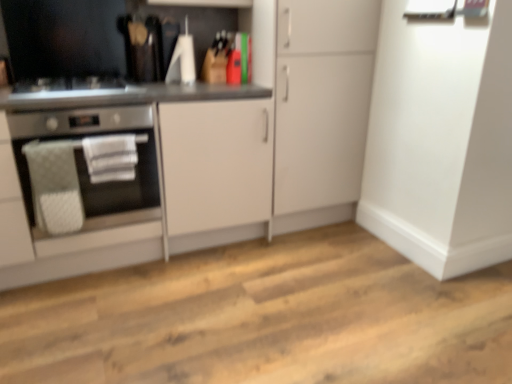
The width and height of the screenshot is (512, 384). What do you see at coordinates (322, 100) in the screenshot? I see `white matte cabinet at center, which appears as the second cabinetry when viewed from the left` at bounding box center [322, 100].

The image size is (512, 384). Find the location of `stainless steel oven at left`. stainless steel oven at left is located at coordinates (86, 165).

The height and width of the screenshot is (384, 512). What do you see at coordinates (73, 88) in the screenshot?
I see `satin black gas stove at left` at bounding box center [73, 88].

Describe the element at coordinates (213, 145) in the screenshot. The height and width of the screenshot is (384, 512). I see `matte white cabinet at center, which ranks as the second cabinetry in right-to-left order` at that location.

Where is `white matte cabinet at center, the 1th cabinetry viewed from the right`? This screenshot has height=384, width=512. white matte cabinet at center, the 1th cabinetry viewed from the right is located at coordinates (322, 100).

Is white matte cabinet at center, which appears as the second cabinetry when viewed from the left, oriented away from matte white cabinet at center, the first cabinetry positioned from the left?

No, matte white cabinet at center, the first cabinetry positioned from the left, is not at the back of white matte cabinet at center, which appears as the second cabinetry when viewed from the left.

Which object is further away from the camera, white matte cabinet at center, which appears as the second cabinetry when viewed from the left, or matte white cabinet at center, which ranks as the second cabinetry in right-to-left order?

white matte cabinet at center, which appears as the second cabinetry when viewed from the left, is more distant.

In terms of size, does white matte cabinet at center, which appears as the second cabinetry when viewed from the left, appear bigger or smaller than matte white cabinet at center, which ranks as the second cabinetry in right-to-left order?

Clearly, white matte cabinet at center, which appears as the second cabinetry when viewed from the left, is smaller in size than matte white cabinet at center, which ranks as the second cabinetry in right-to-left order.

You are a GUI agent. You are given a task and a screenshot of the screen. Output one action in this format:
    pyautogui.click(x=<x>, y=<y>)
    Task: Click on the home appliance that is under the white matte cabinet at center, which appears as the second cabinetry when viewed from the left (from a real-world perspective)
    
    Given the screenshot: What is the action you would take?
    pyautogui.click(x=86, y=165)

Who is shorter, white matte cabinet at center, which appears as the second cabinetry when viewed from the left, or stainless steel oven at left?

stainless steel oven at left.

Is white matte cabinet at center, which appears as the second cabinetry when viewed from the left, looking in the opposite direction of stainless steel oven at left?

No, white matte cabinet at center, which appears as the second cabinetry when viewed from the left, is not facing the opposite direction of stainless steel oven at left.

From a real-world perspective, is white matte cabinet at center, the 1th cabinetry viewed from the right, above or below stainless steel oven at left?

Clearly, from a real-world perspective, white matte cabinet at center, the 1th cabinetry viewed from the right, is above stainless steel oven at left.

Which is nearer, (x=324, y=35) or (x=150, y=211)?

Positioned in front is point (x=150, y=211).

Choose the correct answer: Is matte white cabinet at center, the first cabinetry positioned from the left, inside stainless steel oven at left or outside it?

matte white cabinet at center, the first cabinetry positioned from the left, is located beyond the bounds of stainless steel oven at left.

Does matte white cabinet at center, the first cabinetry positioned from the left, have a smaller size compared to stainless steel oven at left?

No, matte white cabinet at center, the first cabinetry positioned from the left, is not smaller than stainless steel oven at left.

Is matte white cabinet at center, the first cabinetry positioned from the left, facing towards stainless steel oven at left?

Yes, matte white cabinet at center, the first cabinetry positioned from the left, faces towards stainless steel oven at left.

From the picture: Relative to satin black gas stove at left, is matte white cabinet at center, the first cabinetry positioned from the left, in front or behind?

matte white cabinet at center, the first cabinetry positioned from the left, is positioned closer to the viewer than satin black gas stove at left.

Would you say matte white cabinet at center, which ranks as the second cabinetry in right-to-left order, is outside satin black gas stove at left?

Absolutely, matte white cabinet at center, which ranks as the second cabinetry in right-to-left order, is external to satin black gas stove at left.

You are a GUI agent. You are given a task and a screenshot of the screen. Output one action in this format:
    pyautogui.click(x=<x>, y=<y>)
    Task: Click on the 1st cabinetry to the right of the satin black gas stove at left, starting your count from the anchor
    
    Given the screenshot: What is the action you would take?
    pyautogui.click(x=213, y=145)

Is point (3, 284) in front of point (30, 89)?

No, it is behind (30, 89).

From the image's perspective, which is below, satin black gas stove at left or stainless steel oven at left?

stainless steel oven at left is shown below in the image.

Is satin black gas stove at left taller than stainless steel oven at left?

No, satin black gas stove at left is not taller than stainless steel oven at left.

From the picture: How distant is satin black gas stove at left from stainless steel oven at left?

satin black gas stove at left is 10.49 inches from stainless steel oven at left.

Identify the location of home appliance that is below the satin black gas stove at left (from the image's perspective). This screenshot has height=384, width=512. (86, 165).

Is matte white cabinet at center, the first cabinetry positioned from the left, smaller than white matte cabinet at center, the 1th cabinetry viewed from the right?

Actually, matte white cabinet at center, the first cabinetry positioned from the left, might be larger than white matte cabinet at center, the 1th cabinetry viewed from the right.

How far apart are matte white cabinet at center, which ranks as the second cabinetry in right-to-left order, and white matte cabinet at center, the 1th cabinetry viewed from the right?

A distance of 7.87 inches exists between matte white cabinet at center, which ranks as the second cabinetry in right-to-left order, and white matte cabinet at center, the 1th cabinetry viewed from the right.

Is matte white cabinet at center, which ranks as the second cabinetry in right-to-left order, turned away from white matte cabinet at center, which appears as the second cabinetry when viewed from the left?

No, matte white cabinet at center, which ranks as the second cabinetry in right-to-left order, is not facing the opposite direction of white matte cabinet at center, which appears as the second cabinetry when viewed from the left.

Is matte white cabinet at center, the first cabinetry positioned from the left, closer to the viewer compared to white matte cabinet at center, which appears as the second cabinetry when viewed from the left?

Yes.

Where is `the 1st cabinetry below the satin black gas stove at left (from the image's perspective)`? the 1st cabinetry below the satin black gas stove at left (from the image's perspective) is located at coordinates (322, 100).

Between satin black gas stove at left and white matte cabinet at center, which appears as the second cabinetry when viewed from the left, which one appears on the left side from the viewer's perspective?

satin black gas stove at left.

From the image's perspective, is satin black gas stove at left located above white matte cabinet at center, the 1th cabinetry viewed from the right?

Yes, from the image's perspective, satin black gas stove at left is above white matte cabinet at center, the 1th cabinetry viewed from the right.

Image resolution: width=512 pixels, height=384 pixels. What are the coordinates of `cabinetry above the matte white cabinet at center, which ranks as the second cabinetry in right-to-left order (from a real-world perspective)` in the screenshot? It's located at (322, 100).

You are a GUI agent. You are given a task and a screenshot of the screen. Output one action in this format:
    pyautogui.click(x=<x>, y=<y>)
    Task: Click on the home appliance in front of the white matte cabinet at center, the 1th cabinetry viewed from the right
    
    Given the screenshot: What is the action you would take?
    pyautogui.click(x=86, y=165)

Looking at the image, which one is located further to white matte cabinet at center, which appears as the second cabinetry when viewed from the left, matte white cabinet at center, the first cabinetry positioned from the left, or stainless steel oven at left?

stainless steel oven at left.

Which object lies nearer to the anchor point satin black gas stove at left, white matte cabinet at center, the 1th cabinetry viewed from the right, or stainless steel oven at left?

Based on the image, stainless steel oven at left appears to be nearer to satin black gas stove at left.

From the image, which object appears to be nearer to stainless steel oven at left, white matte cabinet at center, which appears as the second cabinetry when viewed from the left, or matte white cabinet at center, the first cabinetry positioned from the left?

matte white cabinet at center, the first cabinetry positioned from the left, is closer to stainless steel oven at left.

Estimate the real-world distances between objects in this image. Which object is closer to matte white cabinet at center, the first cabinetry positioned from the left, white matte cabinet at center, the 1th cabinetry viewed from the right, or satin black gas stove at left?

Among the two, white matte cabinet at center, the 1th cabinetry viewed from the right, is located nearer to matte white cabinet at center, the first cabinetry positioned from the left.

From the picture: When comparing their distances from satin black gas stove at left, does matte white cabinet at center, the first cabinetry positioned from the left, or stainless steel oven at left seem closer?

stainless steel oven at left.

Considering their positions, is satin black gas stove at left positioned further to white matte cabinet at center, which appears as the second cabinetry when viewed from the left, than matte white cabinet at center, which ranks as the second cabinetry in right-to-left order?

satin black gas stove at left is further to white matte cabinet at center, which appears as the second cabinetry when viewed from the left.

Considering their positions, is stainless steel oven at left positioned further to white matte cabinet at center, the 1th cabinetry viewed from the right, than satin black gas stove at left?

satin black gas stove at left lies further to white matte cabinet at center, the 1th cabinetry viewed from the right, than the other object.

From the image, which object appears to be farther from white matte cabinet at center, the 1th cabinetry viewed from the right, matte white cabinet at center, which ranks as the second cabinetry in right-to-left order, or satin black gas stove at left?

satin black gas stove at left lies further to white matte cabinet at center, the 1th cabinetry viewed from the right, than the other object.

Where is `home appliance between satin black gas stove at left and white matte cabinet at center, the 1th cabinetry viewed from the right, in the horizontal direction`? This screenshot has height=384, width=512. home appliance between satin black gas stove at left and white matte cabinet at center, the 1th cabinetry viewed from the right, in the horizontal direction is located at coordinates (86, 165).

Locate an element on the screen. home appliance between satin black gas stove at left and matte white cabinet at center, which ranks as the second cabinetry in right-to-left order, in the vertical direction is located at coordinates (86, 165).

Find the location of a particular element. This screenshot has width=512, height=384. cabinetry between stainless steel oven at left and white matte cabinet at center, the 1th cabinetry viewed from the right, in the horizontal direction is located at coordinates (213, 145).

Identify the location of cabinetry between satin black gas stove at left and white matte cabinet at center, which appears as the second cabinetry when viewed from the left, from left to right. The image size is (512, 384). (213, 145).